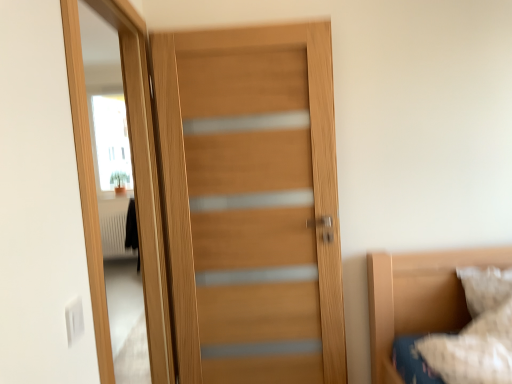
Question: Is the position of wooden door at left more distant than that of white textured pillow at lower right?

Choices:
 (A) no
 (B) yes

Answer: (A)

Question: Considering the relative sizes of wooden door at left and white textured pillow at lower right in the image provided, is wooden door at left shorter than white textured pillow at lower right?

Choices:
 (A) yes
 (B) no

Answer: (B)

Question: Is wooden door at left in front of white textured pillow at lower right?

Choices:
 (A) no
 (B) yes

Answer: (B)

Question: Is wooden door at left facing away from white textured pillow at lower right?

Choices:
 (A) yes
 (B) no

Answer: (B)

Question: Is wooden door at left at the left side of white textured pillow at lower right?

Choices:
 (A) no
 (B) yes

Answer: (B)

Question: From the image's perspective, is white textured pillow at lower right above or below wooden door at center?

Choices:
 (A) above
 (B) below

Answer: (B)

Question: From a real-world perspective, relative to wooden door at center, is white textured pillow at lower right vertically above or below?

Choices:
 (A) above
 (B) below

Answer: (B)

Question: Looking at the image, does white textured pillow at lower right seem bigger or smaller compared to wooden door at center?

Choices:
 (A) big
 (B) small

Answer: (B)

Question: Would you say white textured pillow at lower right is to the left or to the right of wooden door at center in the picture?

Choices:
 (A) left
 (B) right

Answer: (B)

Question: Would you say wooden door at left is inside or outside wooden door at center?

Choices:
 (A) outside
 (B) inside

Answer: (A)

Question: Visually, is wooden door at left positioned to the left or to the right of wooden door at center?

Choices:
 (A) left
 (B) right

Answer: (A)

Question: In terms of width, does wooden door at left look wider or thinner when compared to wooden door at center?

Choices:
 (A) thin
 (B) wide

Answer: (B)

Question: Considering the positions of point (148, 344) and point (305, 187), is point (148, 344) closer or farther from the camera than point (305, 187)?

Choices:
 (A) farther
 (B) closer

Answer: (A)

Question: In the image, is white textured pillow at lower right positioned in front of or behind wooden door at left?

Choices:
 (A) front
 (B) behind

Answer: (B)

Question: Is white textured pillow at lower right spatially inside wooden door at left, or outside of it?

Choices:
 (A) inside
 (B) outside

Answer: (B)